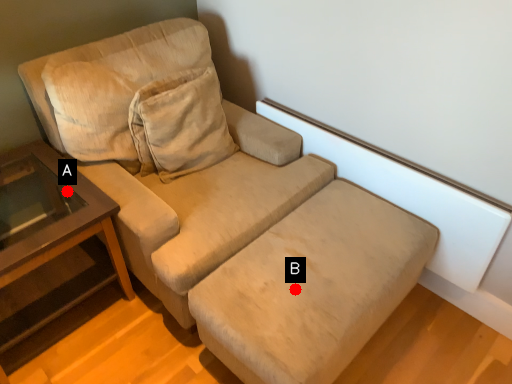
Question: Two points are circled on the image, labeled by A and B beside each circle. Which point is closer to the camera?

Choices:
 (A) A is closer
 (B) B is closer

Answer: (B)